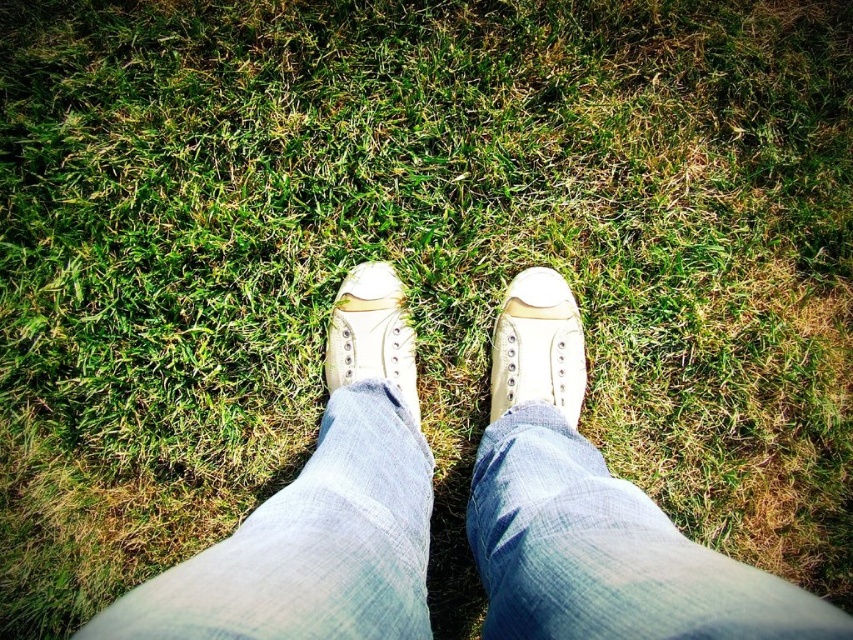
Question: Is denim at center above matte white sneaker at center?

Choices:
 (A) yes
 (B) no

Answer: (B)

Question: Which point is farther to the camera?

Choices:
 (A) white canvas shoe at center
 (B) denim at center
 (C) matte white sneaker at center

Answer: (C)

Question: Among these points, which one is nearest to the camera?

Choices:
 (A) (650, 618)
 (B) (512, 348)
 (C) (361, 300)

Answer: (A)

Question: Is the position of denim at center more distant than that of white canvas shoe at center?

Choices:
 (A) yes
 (B) no

Answer: (B)

Question: Can you confirm if denim at center is wider than matte white sneaker at center?

Choices:
 (A) no
 (B) yes

Answer: (B)

Question: Which of the following is the closest to the observer?

Choices:
 (A) matte white sneaker at center
 (B) white canvas shoe at center
 (C) denim at center

Answer: (C)